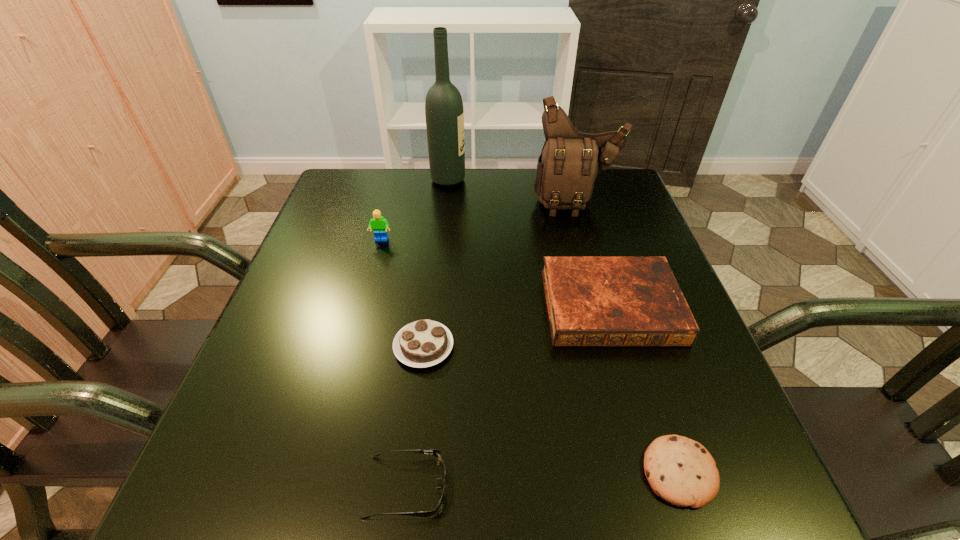
At what (x,y) coordinates should I click in order to perform the action: click on vacant area that lies between the fifth tallest object and the second tallest object. Please return your answer as a coordinate pair (x, y). This screenshot has width=960, height=540. Looking at the image, I should click on (500, 274).

Identify the location of vacant area that lies between the third tallest object and the sunglasses. (394, 363).

Where is `free space between the chocolate cake and the Lego`? Image resolution: width=960 pixels, height=540 pixels. free space between the chocolate cake and the Lego is located at coordinates (402, 293).

This screenshot has height=540, width=960. What are the coordinates of `free space that is in between the sunglasses and the shoulder bag` in the screenshot? It's located at (491, 345).

Where is `vacant space that's between the tallest object and the Bible`? vacant space that's between the tallest object and the Bible is located at coordinates (530, 243).

You are a GUI agent. You are given a task and a screenshot of the screen. Output one action in this format:
    pyautogui.click(x=<x>, y=<y>)
    Task: Click on the unoccupied area between the sunglasses and the chocolate cake
    
    Given the screenshot: What is the action you would take?
    pyautogui.click(x=415, y=416)

Locate an element on the screen. free space between the fifth shortest object and the cookie is located at coordinates (530, 356).

The width and height of the screenshot is (960, 540). Identify the location of empty space between the second tallest object and the sunglasses. (491, 345).

In order to click on empty space between the chocolate cake and the sunglasses in this screenshot , I will do `click(415, 416)`.

This screenshot has height=540, width=960. Identify the location of empty space between the chocolate cake and the fourth tallest object. (517, 326).